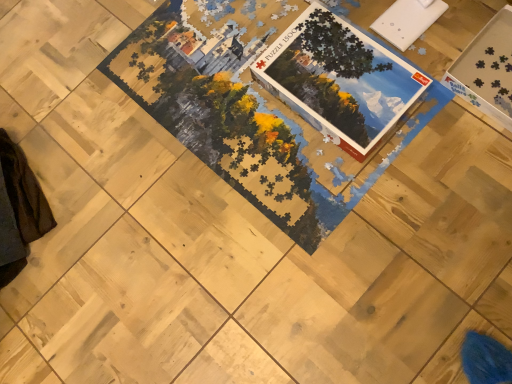
You are a GUI agent. You are given a task and a screenshot of the screen. Output one action in this format:
    pyautogui.click(x=<x>, y=<y>)
    Task: Click on the vacant region above matte cardboard puzzle box at center (from a real-world perspective)
    
    Given the screenshot: What is the action you would take?
    337,71